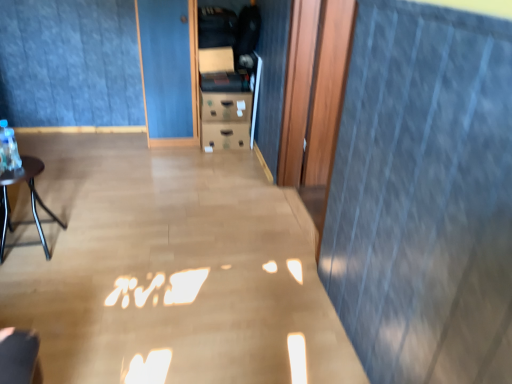
Locate an element on the screen. The image size is (512, 384). vacant space underneath matte black table at left (from a real-world perspective) is located at coordinates (41, 247).